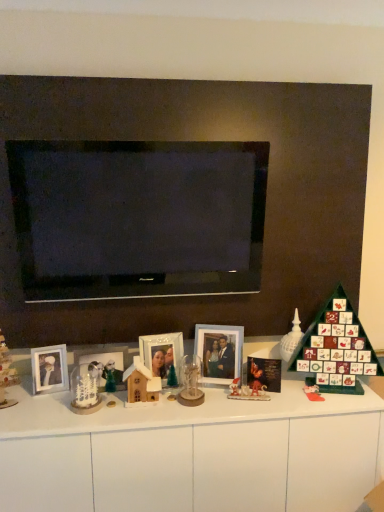
You are a GUI agent. You are given a task and a screenshot of the screen. Output one action in this format:
    pyautogui.click(x=<x>, y=<y>)
    Task: Click on the free space that is in between white frosted glass candle holder at lower left, positioned as the first candle holder in left-to-right order, and matte white glass dome at lower left
    This screenshot has height=512, width=384.
    Given the screenshot: What is the action you would take?
    pyautogui.click(x=40, y=408)